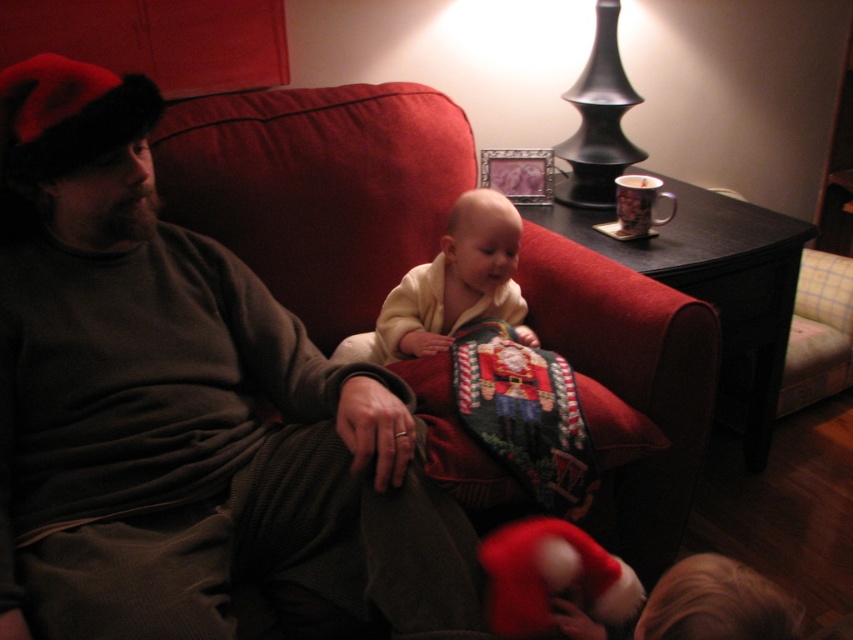
You are a photographer setting up for a family photo. You need to place a small Christmas ornament between the velvet cushion at center and the soft cream sweater at center. Which object should the ornament be closer to if it needs to be near the larger item?

The velvet cushion at center is larger than the soft cream sweater at center, so the ornament should be placed closer to the velvet cushion at center.

You are a photographer setting up for a family photo. You notice the velvet cushion at center and the soft cream sweater at center in the scene. Where should you position your camera to ensure both items are in frame without moving any objects?

Position the camera above the velvet cushion at center since it is located below the soft cream sweater at center, allowing both items to be captured in the frame without obstruction.